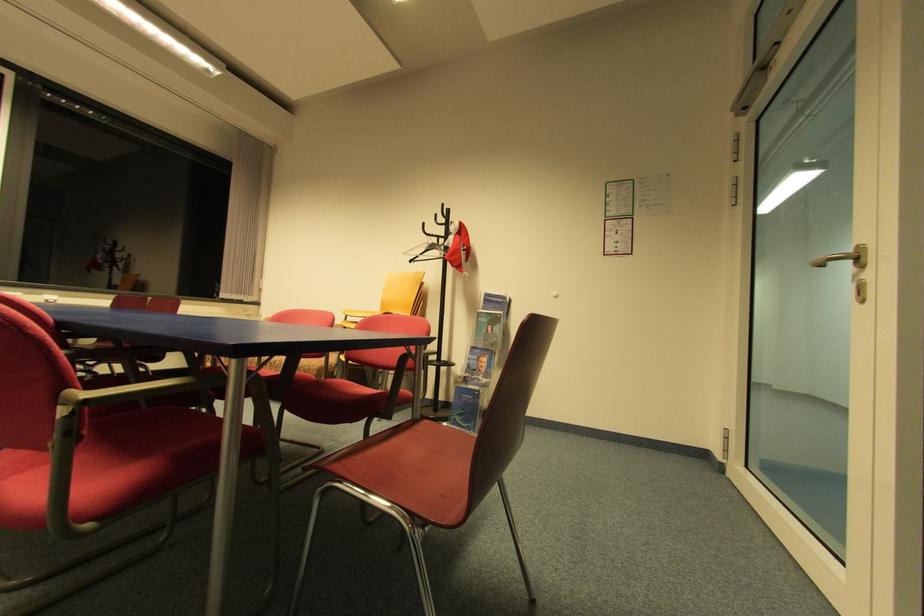
Find the location of a particular element. Image resolution: width=924 pixels, height=616 pixels. clothes hanger is located at coordinates (440, 254).